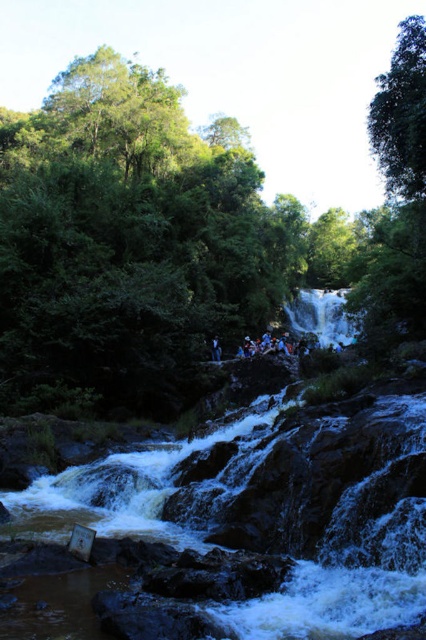
You are standing at the edge of the white smooth waterfall at center and looking down at the dark blue fabric person at center. Which object is taller from your viewpoint?

The white smooth waterfall at center is much taller than the dark blue fabric person at center.

You are planning to build a footbridge that is 30 meters long between the brown rocky creek at center and the white smooth waterfall at center. Based on the scene description, will the footbridge fit between them without any modifications?

The brown rocky creek at center and white smooth waterfall at center are 30.36 meters apart. Since the footbridge is 30 meters long, it will fit between them with a small gap of 0.36 meters remaining.